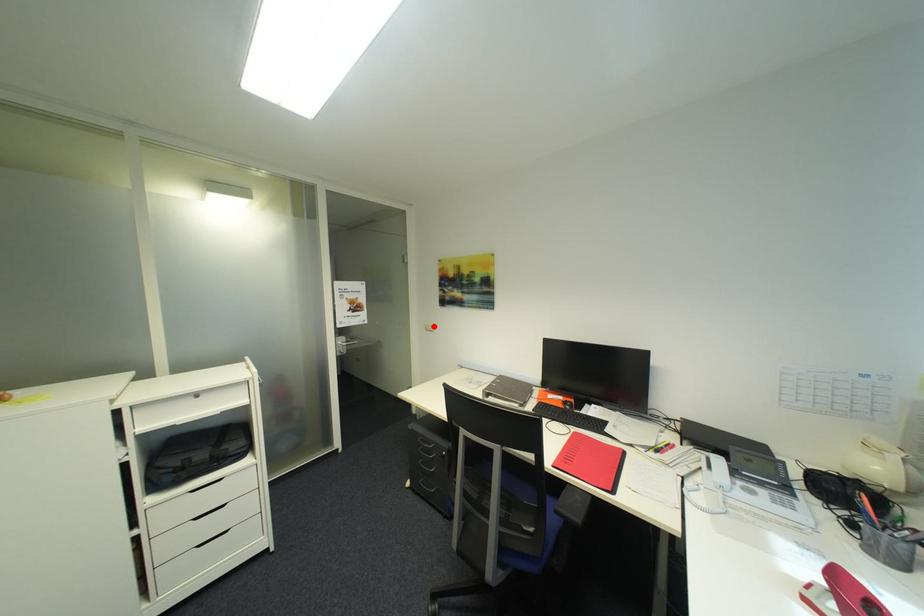
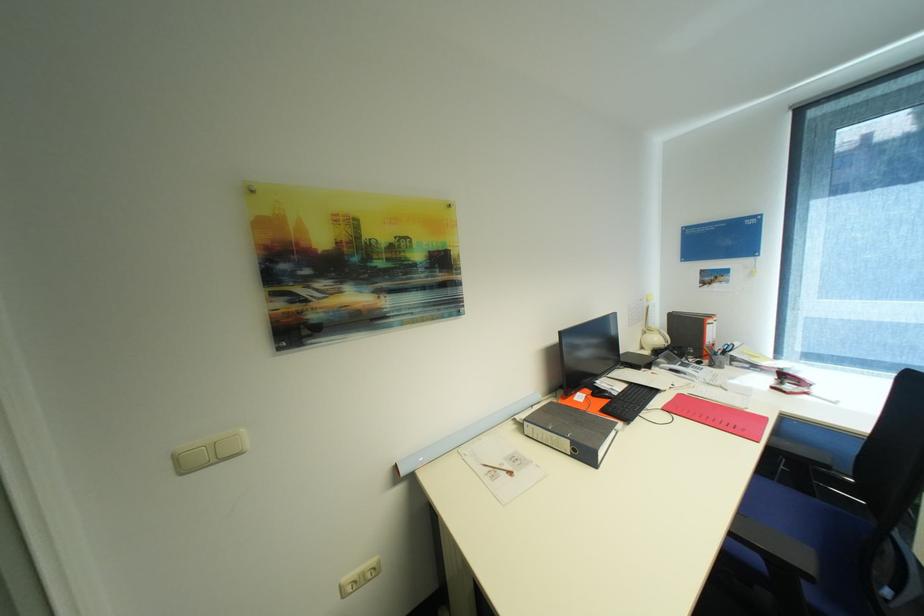
Find the pixel in the second image that matches the highlighted location in the first image.

(185, 458)